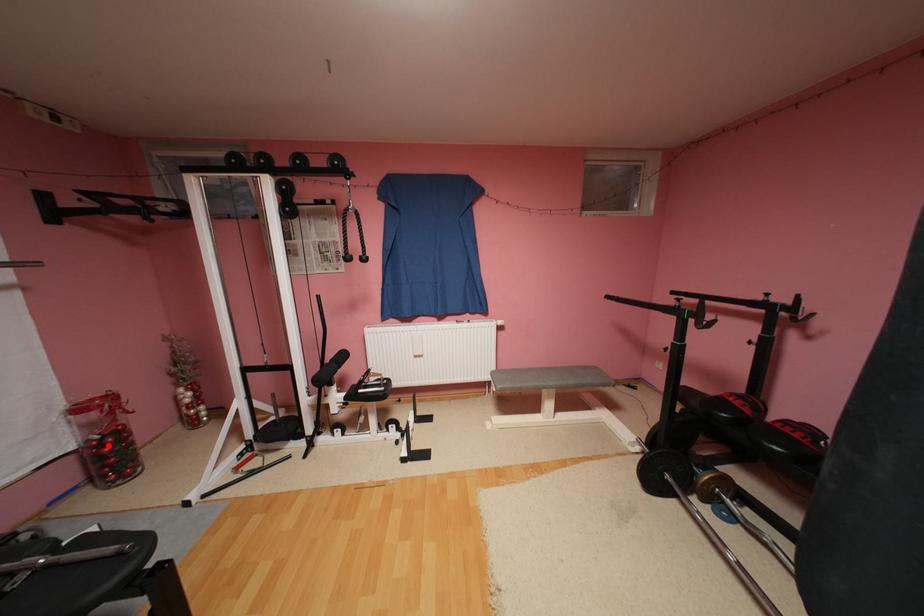
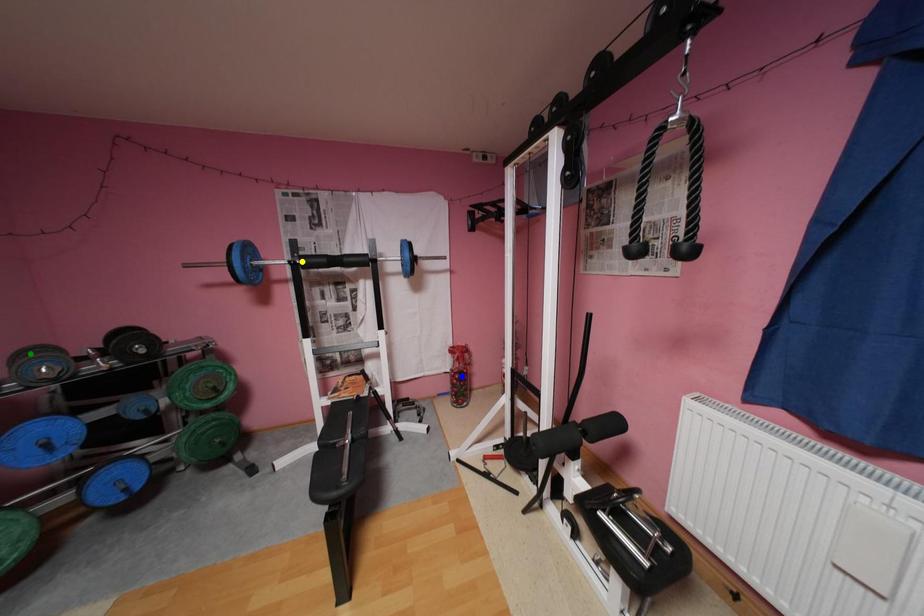
Question: I am providing you with two images of the same scene from different viewpoints. A red point is marked on the first image. You are given multiple points on the second image. Which spot in image 2 lines up with the point in image 1?

Choices:
 (A) yellow point
 (B) green point
 (C) blue point

Answer: (C)